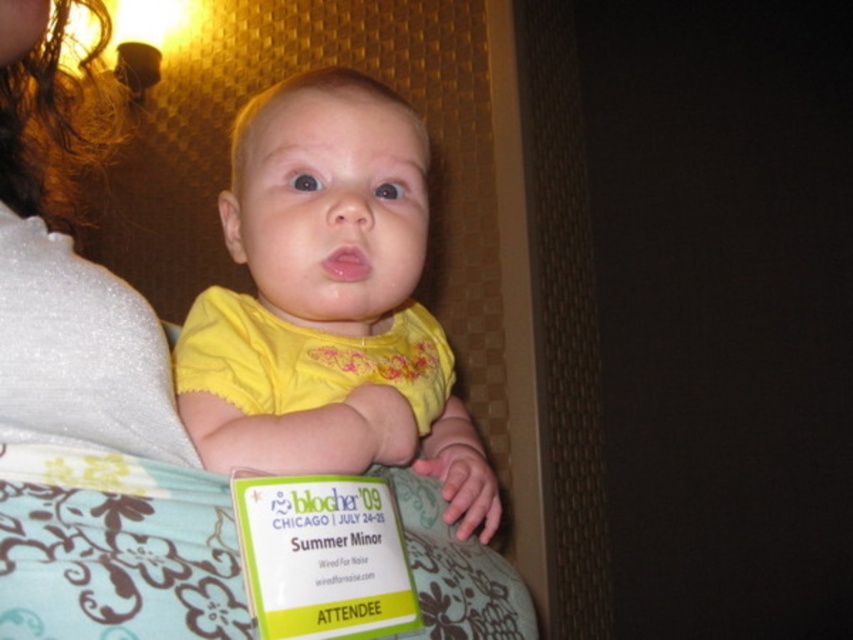
Is point (421, 417) closer to camera compared to point (172, 625)?

No, it is not.

Is yellow fabric baby at center in front of white sparkly fabric at upper left?

No.

Who is more forward, (289, 112) or (126, 589)?

Point (126, 589)

Identify the location of yellow fabric baby at center. The width and height of the screenshot is (853, 640). click(329, 304).